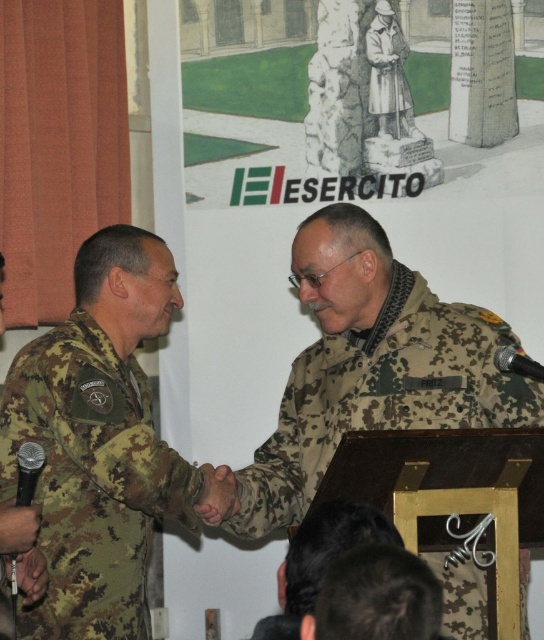
Question: Which object is the farthest from the camouflage fabric uniform at center?

Choices:
 (A) camouflage fabric uniform at left
 (B) black metallic microphone at lower left
 (C) camouflage fabric uniform at upper center
 (D) camouflage uniform at left

Answer: (C)

Question: Among these points, which one is farthest from the camera?

Choices:
 (A) (20, 516)
 (B) (401, 48)

Answer: (B)

Question: Can you confirm if camouflage fabric uniform at center is bigger than camouflage uniform at left?

Choices:
 (A) yes
 (B) no

Answer: (A)

Question: Which object is the farthest from the camouflage fabric uniform at left?

Choices:
 (A) camouflage fabric uniform at center
 (B) black matte microphone at right
 (C) camouflage uniform at left

Answer: (B)

Question: Can you confirm if camouflage fabric uniform at left is positioned below camouflage uniform at left?

Choices:
 (A) no
 (B) yes

Answer: (A)

Question: Can you confirm if camouflage uniform at left is smaller than black matte microphone at right?

Choices:
 (A) yes
 (B) no

Answer: (A)